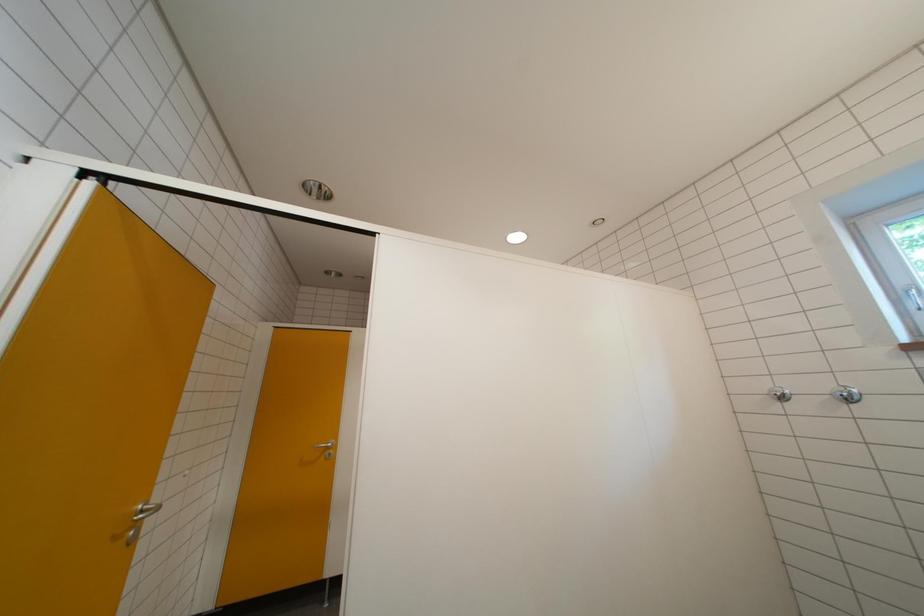
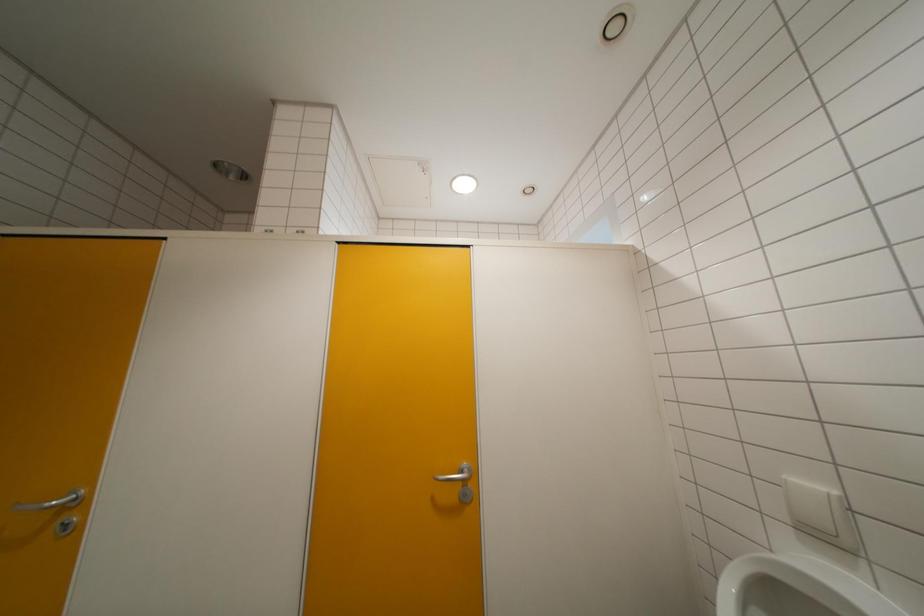
Question: The images are taken continuously from a first-person perspective. In which direction are you moving?

Choices:
 (A) Left
 (B) Right
 (C) Forward
 (D) Backward

Answer: (C)